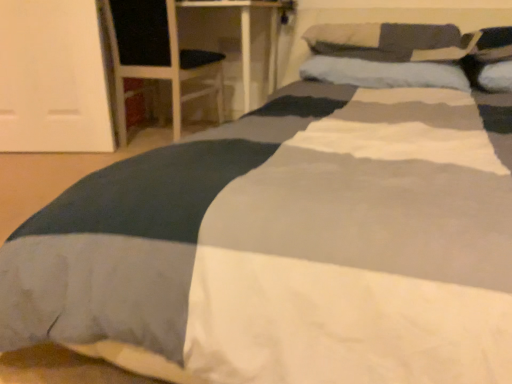
Question: Considering the positions of soft gray pillow at upper right, which appears as the first pillow when viewed from the top, and black fabric armchair at left in the image, is soft gray pillow at upper right, which appears as the first pillow when viewed from the top, wider or thinner than black fabric armchair at left?

Choices:
 (A) thin
 (B) wide

Answer: (A)

Question: Considering the relative positions of soft gray pillow at upper right, which appears as the first pillow when viewed from the top, and black fabric armchair at left in the image provided, is soft gray pillow at upper right, which appears as the first pillow when viewed from the top, to the left or to the right of black fabric armchair at left?

Choices:
 (A) left
 (B) right

Answer: (B)

Question: Estimate the real-world distances between objects in this image. Which object is closer to the black fabric armchair at left?

Choices:
 (A) soft gray pillow at upper right, acting as the second pillow starting from the bottom
 (B) soft blue pillow at center, which is counted as the second pillow, starting from the top

Answer: (B)

Question: Which object is positioned farthest from the black fabric armchair at left?

Choices:
 (A) soft blue pillow at center, which is the first pillow from bottom to top
 (B) soft gray pillow at upper right, acting as the second pillow starting from the bottom

Answer: (B)